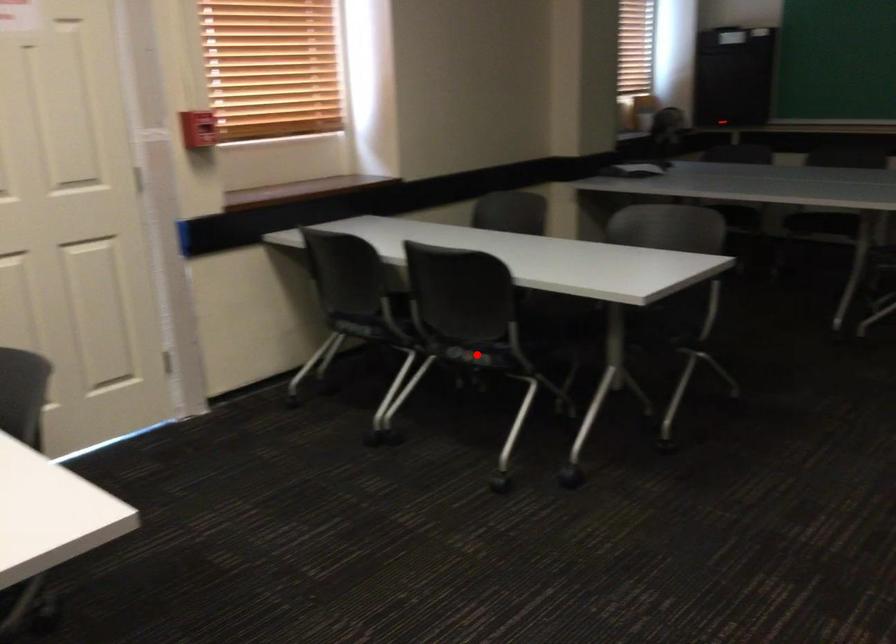
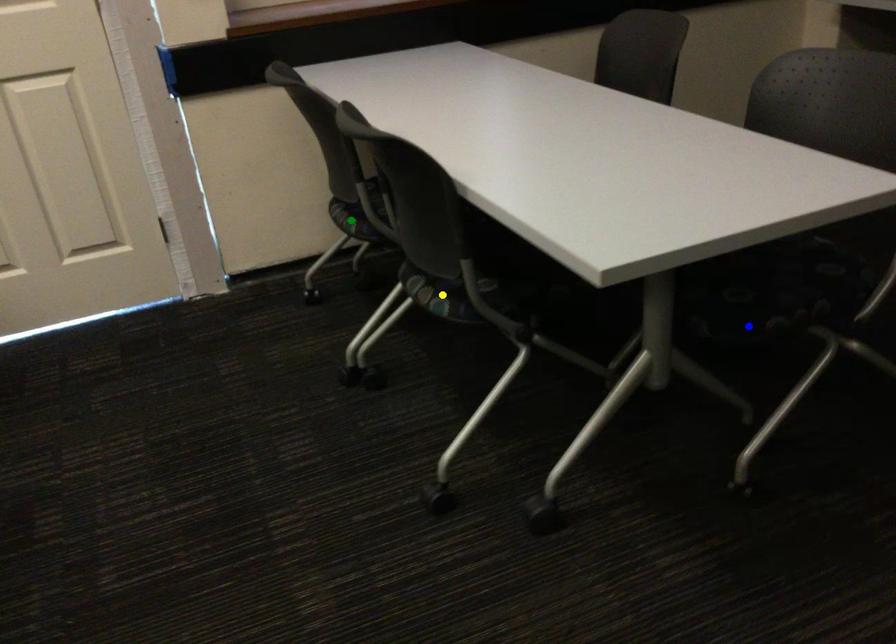
Question: I am providing you with two images of the same scene from different viewpoints. A red point is marked on the first image. You are given multiple points on the second image. Can you choose the point in image 2 that corresponds to the point in image 1?

Choices:
 (A) yellow point
 (B) green point
 (C) blue point

Answer: (A)